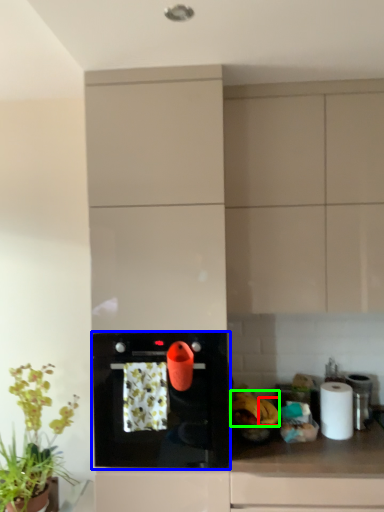
Question: Which object is positioned farthest from banana (highlighted by a red box)? Select from kitchen appliance (highlighted by a blue box) and banana (highlighted by a green box).

Choices:
 (A) kitchen appliance
 (B) banana

Answer: (A)